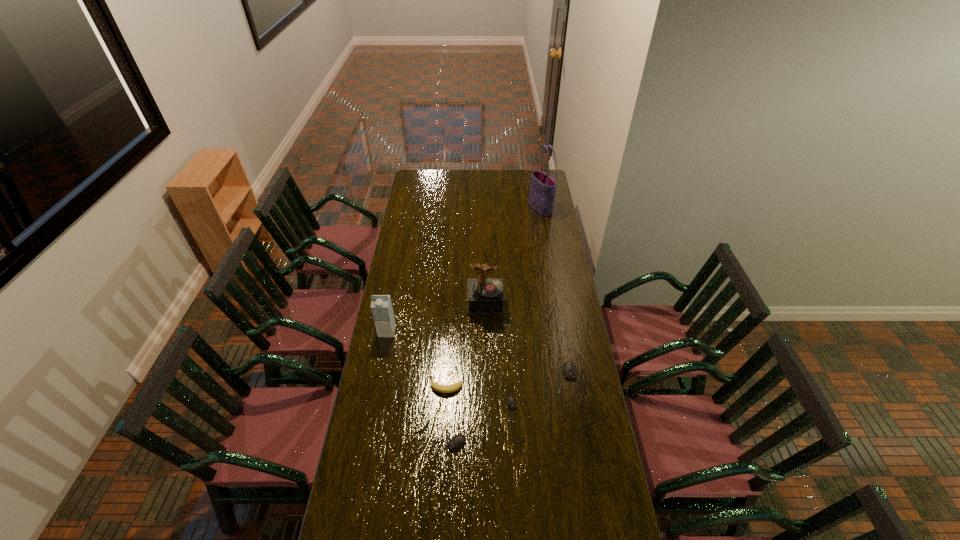
This screenshot has width=960, height=540. I want to click on free spot between the phonograph_record and the banana, so click(x=466, y=345).

The width and height of the screenshot is (960, 540). Identify the location of free spot between the second tallest object and the banana. (466, 345).

This screenshot has height=540, width=960. I want to click on vacant space that's between the farthest mouse and the phonograph_record, so click(x=526, y=341).

This screenshot has height=540, width=960. In order to click on vacant area that lies between the tote bag and the sixth nearest object in this screenshot , I will do `click(513, 256)`.

Where is `free area in between the banana and the shortest mouse`? free area in between the banana and the shortest mouse is located at coordinates (478, 397).

The width and height of the screenshot is (960, 540). In order to click on free point between the banana and the sixth nearest object in this screenshot , I will do `click(466, 345)`.

Image resolution: width=960 pixels, height=540 pixels. I want to click on unoccupied position between the shortest object and the farthest object, so (x=525, y=309).

Where is `free space between the farthest object and the leftmost object`? The height and width of the screenshot is (540, 960). free space between the farthest object and the leftmost object is located at coordinates (464, 270).

Where is `object identified as the second closest to the shortest mouse`? Image resolution: width=960 pixels, height=540 pixels. object identified as the second closest to the shortest mouse is located at coordinates (435, 386).

Find the location of `object that is the sixth closest one to the nearest object`. object that is the sixth closest one to the nearest object is located at coordinates (543, 187).